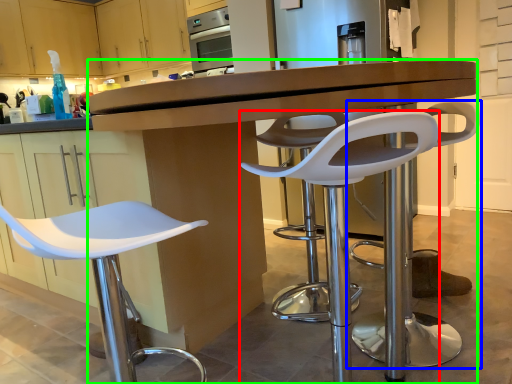
Question: Estimate the real-world distances between objects in this image. Which object is closer to chair (highlighted by a red box), chair (highlighted by a blue box) or desk (highlighted by a green box)?

Choices:
 (A) chair
 (B) desk

Answer: (A)